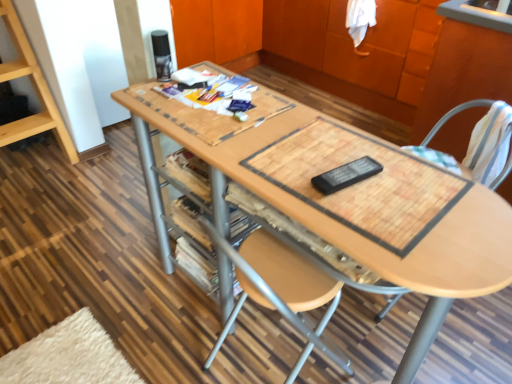
You are a GUI agent. You are given a task and a screenshot of the screen. Output one action in this format:
    pyautogui.click(x=<x>, y=<y>)
    Task: Click on the blank space to the left of wooden table at center
    This screenshot has width=512, height=384.
    Given the screenshot: What is the action you would take?
    pyautogui.click(x=99, y=289)